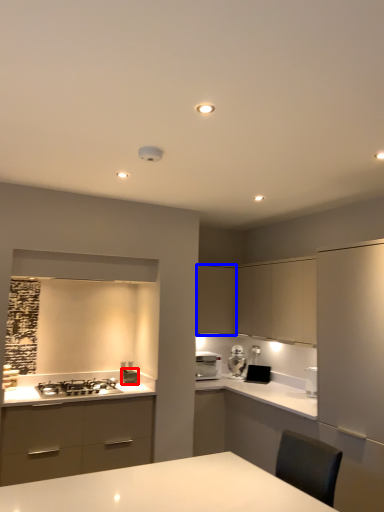
Question: Among these objects, which one is nearest to the camera, appliance (highlighted by a red box) or cabinetry (highlighted by a blue box)?

Choices:
 (A) appliance
 (B) cabinetry

Answer: (A)